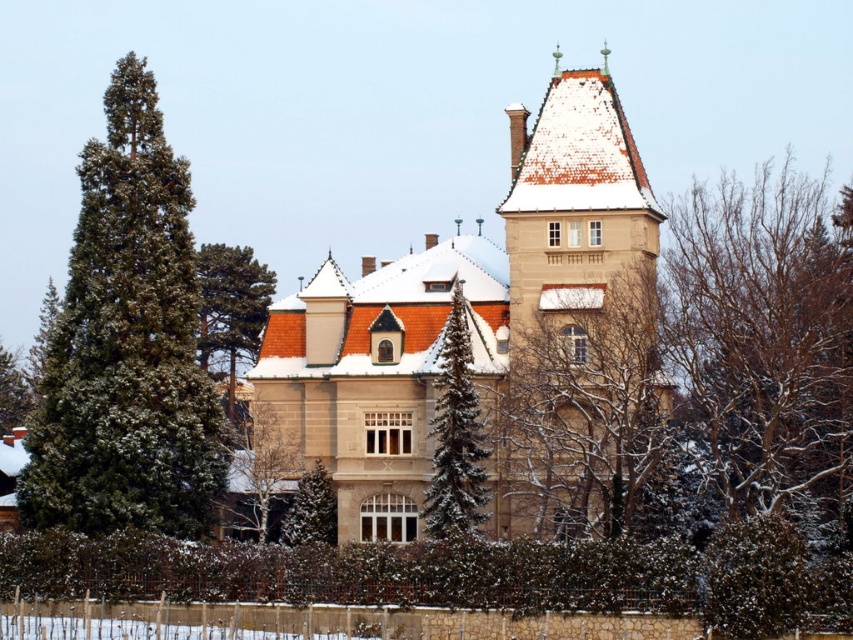
You are standing in front of the grand building and want to take a photo that includes both the green textured tree at lower center and the green textured pine tree at lower left. Which tree should you position closer to the camera to ensure both are in the frame?

The green textured tree at lower center is already closer to the viewer than the green textured pine tree at lower left, so you should position yourself closer to the green textured pine tree at lower left to include both in the frame.